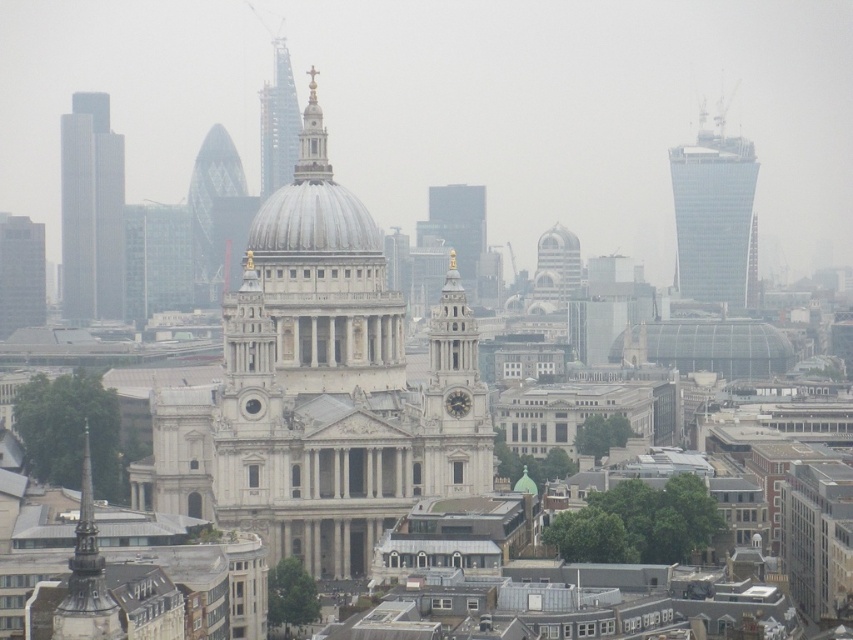
Question: Which point is farther to the camera?

Choices:
 (A) (233, 320)
 (B) (202, 300)
 (C) (310, 154)
 (D) (483, 451)

Answer: (B)

Question: Is white glass tower at center to the left of white marble clock at center from the viewer's perspective?

Choices:
 (A) no
 (B) yes

Answer: (A)

Question: Does goldmaterial/texturespire at center appear on the right side of white marble clock at center?

Choices:
 (A) yes
 (B) no

Answer: (B)

Question: Based on their relative distances, which object is nearer to the glass diamond-patterned tower at upper left?

Choices:
 (A) white stone clock tower at center
 (B) white marble dome at center

Answer: (B)

Question: Can you confirm if white stone dome at center is positioned to the left of goldmaterial/texturespire at center?

Choices:
 (A) no
 (B) yes

Answer: (B)

Question: Which point is farther to the camera?

Choices:
 (A) (463, 392)
 (B) (306, 166)

Answer: (B)